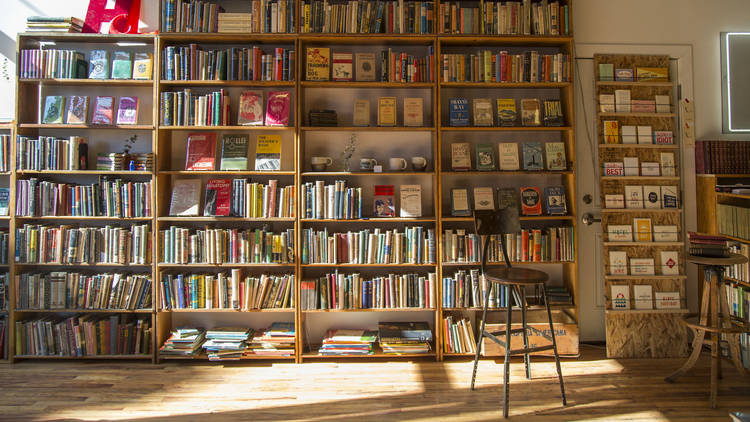
Locate an element on the screen. Image resolution: width=750 pixels, height=422 pixels. books on each shelf is located at coordinates (248, 236), (394, 225), (471, 222).